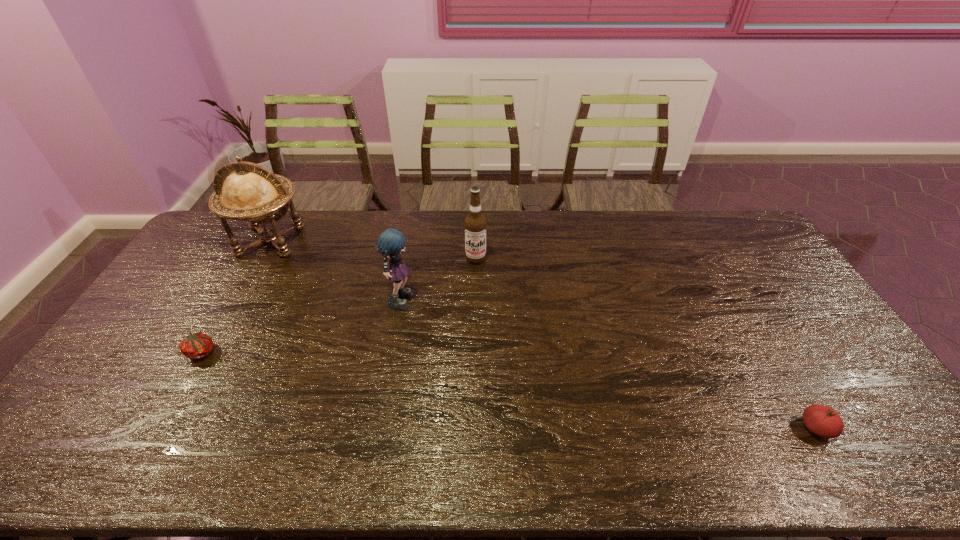
Find the location of a particular element. free space between the third object from right to left and the globe is located at coordinates (336, 268).

What are the coordinates of `unoccupied area between the right tomato and the shortest object` in the screenshot? It's located at (509, 390).

Where is `free spot between the fourth farthest object and the alcohol`? free spot between the fourth farthest object and the alcohol is located at coordinates (339, 306).

Select which object is the second closest to the farther tomato. Please provide its 2D coordinates. Your answer should be formatted as a tuple, i.e. [(x, y)], where the tuple contains the x and y coordinates of a point satisfying the conditions above.

[(391, 242)]

Identify the location of object that is the second nearest to the nearest object. (391, 242).

At what (x,y) coordinates should I click in order to perform the action: click on vacant area that satisfies the following two spatial constraints: 1. on the label of the alcohol; 2. on the left side of the taller tomato. Please return your answer as a coordinate pair (x, y). Looking at the image, I should click on (474, 428).

Find the location of a particular element. The height and width of the screenshot is (540, 960). vacant area in the image that satisfies the following two spatial constraints: 1. on the label of the second object from right to left; 2. on the left side of the rightmost object is located at coordinates (474, 428).

The width and height of the screenshot is (960, 540). In order to click on free location that satisfies the following two spatial constraints: 1. on the label of the alcohol; 2. on the front-facing side of the third object from left to right in this screenshot , I will do `click(475, 296)`.

Identify the location of free space that satisfies the following two spatial constraints: 1. on the front-facing side of the right tomato; 2. on the left side of the globe. The height and width of the screenshot is (540, 960). (166, 428).

Locate an element on the screen. vacant space that satisfies the following two spatial constraints: 1. on the back side of the rightmost object; 2. on the front-facing side of the third object from left to right is located at coordinates (737, 296).